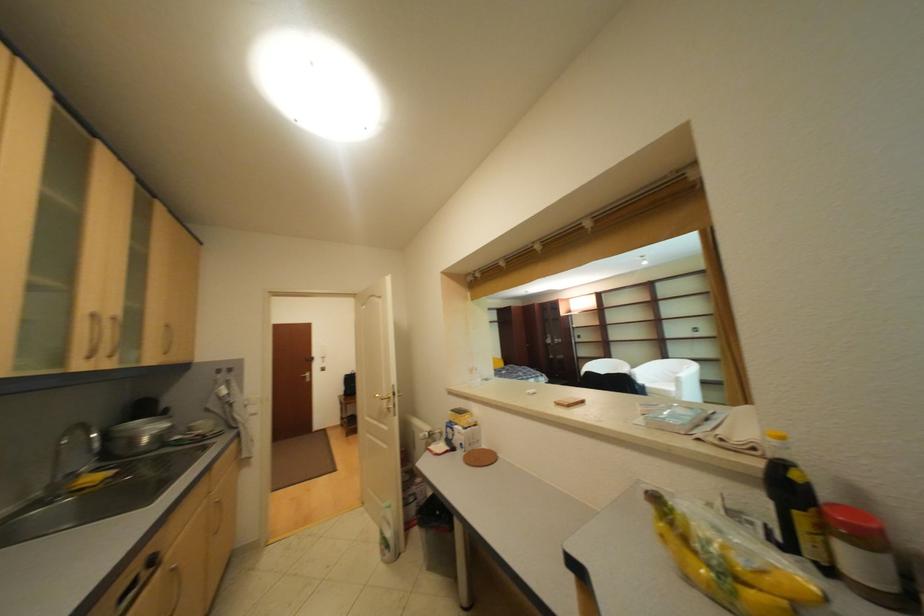
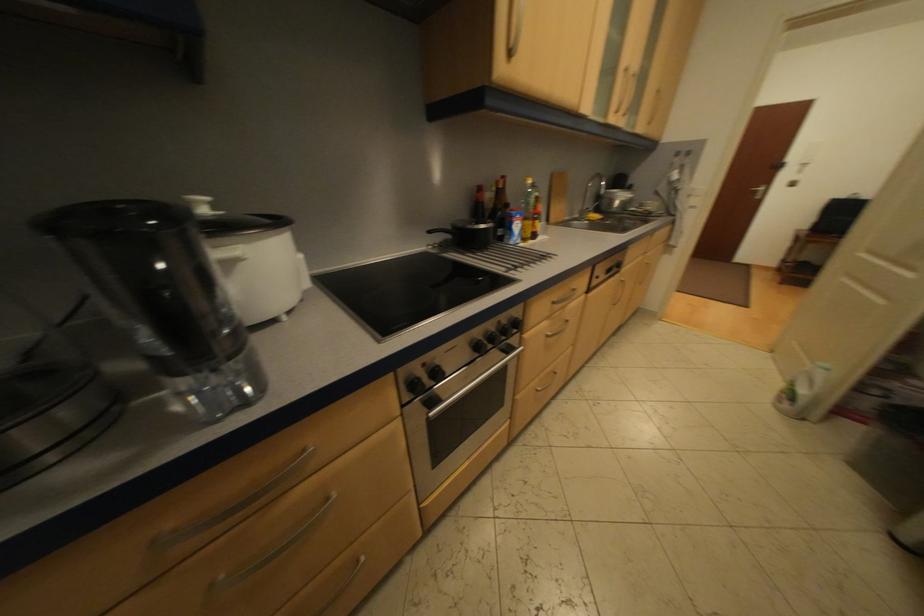
The images are taken continuously from a first-person perspective. In which direction is your viewpoint rotating?

The rotation direction of the camera is left-down.